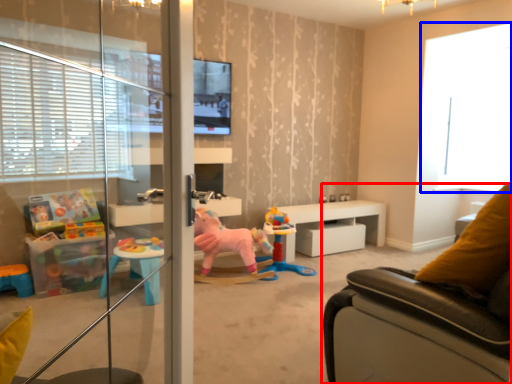
Question: Which of the following is the farthest to the observer, studio couch (highlighted by a red box) or window (highlighted by a blue box)?

Choices:
 (A) studio couch
 (B) window

Answer: (B)